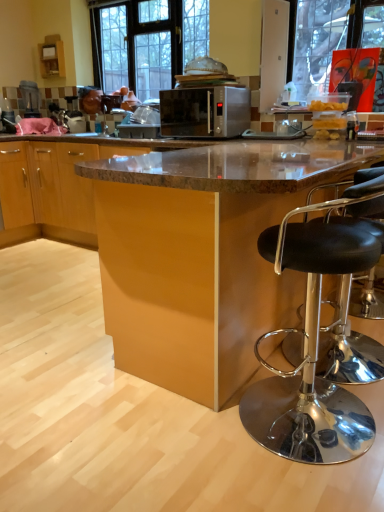
Question: Is brown glossy table at center spatially inside black leather stool at right, or outside of it?

Choices:
 (A) inside
 (B) outside

Answer: (B)

Question: In terms of width, does brown glossy table at center look wider or thinner when compared to black leather stool at right?

Choices:
 (A) thin
 (B) wide

Answer: (B)

Question: Estimate the real-world distances between objects in this image. Which object is closer to the satin silver microwave at center?

Choices:
 (A) brown glossy table at center
 (B) black leather stool at right
 (C) black glass window at upper center

Answer: (C)

Question: Which is farther from the satin silver microwave at center?

Choices:
 (A) black leather stool at right
 (B) black glass window at upper center
 (C) brown glossy table at center

Answer: (A)